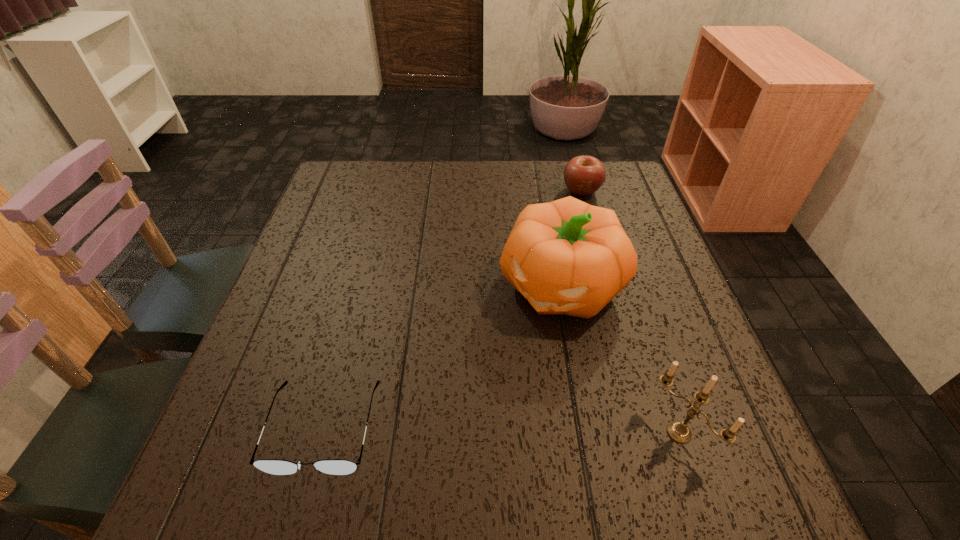
Identify the location of pumpkin situated at the right edge. (568, 257).

You are a GUI agent. You are given a task and a screenshot of the screen. Output one action in this format:
    pyautogui.click(x=<x>, y=<y>)
    Task: Click on the object at the near left corner
    This screenshot has height=540, width=960.
    Given the screenshot: What is the action you would take?
    pyautogui.click(x=272, y=466)

Locate an element on the screen. This screenshot has height=540, width=960. object located at the far right corner is located at coordinates point(583,175).

Identify the location of object located at the near right corner. The height and width of the screenshot is (540, 960). (678, 431).

Find the location of a particular element. free spot at the far edge of the desktop is located at coordinates (417, 196).

At what (x,y) coordinates should I click in order to perform the action: click on blank space at the near edge of the desktop. Please return your answer as a coordinate pair (x, y). The image size is (960, 540). Looking at the image, I should click on (485, 420).

Where is `free space at the left edge of the desktop`? This screenshot has height=540, width=960. free space at the left edge of the desktop is located at coordinates (358, 265).

Where is `free space at the far left corner of the desktop`? The height and width of the screenshot is (540, 960). free space at the far left corner of the desktop is located at coordinates (365, 166).

Locate an element on the screen. vacant space at the far right corner of the desktop is located at coordinates (625, 184).

At what (x,y) coordinates should I click in order to perform the action: click on free space at the near right corner. Please return your answer as a coordinate pair (x, y). The width and height of the screenshot is (960, 540). Looking at the image, I should click on (651, 444).